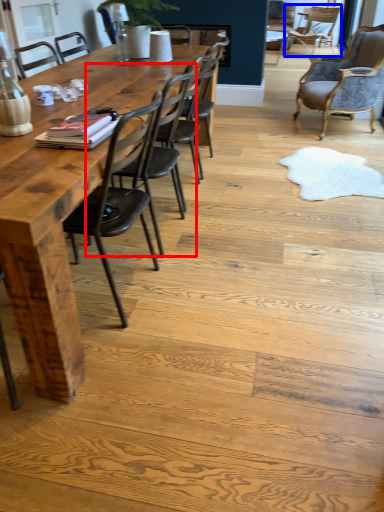
Question: Among these objects, which one is farthest to the camera, chair (highlighted by a red box) or chair (highlighted by a blue box)?

Choices:
 (A) chair
 (B) chair

Answer: (B)